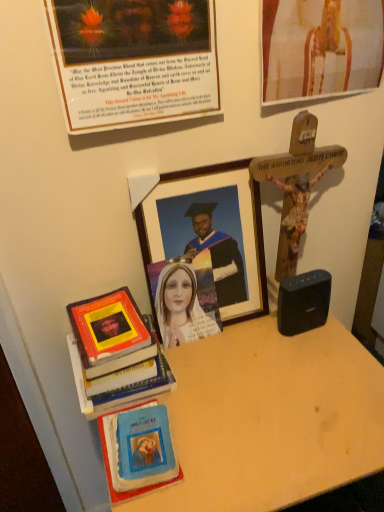
Locate an element on the screen. This screenshot has height=512, width=384. vacant point above wooden table at lower left (from a real-world perspective) is located at coordinates (241, 387).